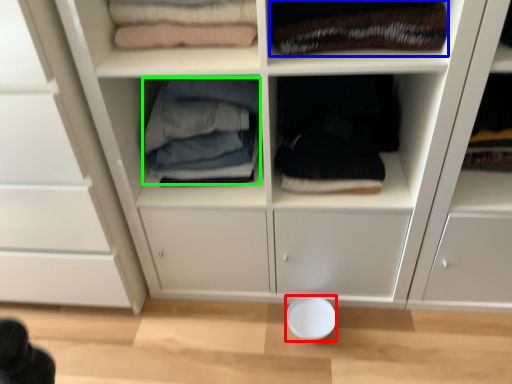
Question: Based on their relative distances, which object is nearer to bowl (highlighted by a red box)? Choose from clothing (highlighted by a blue box) and clothing (highlighted by a green box).

Choices:
 (A) clothing
 (B) clothing

Answer: (B)